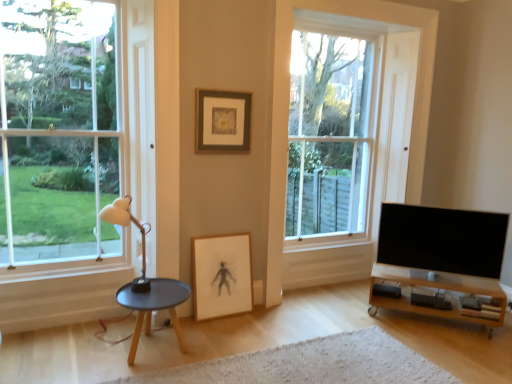
This screenshot has height=384, width=512. I want to click on free point below black glossy tv at lower right (from a real-world perspective), so click(x=458, y=286).